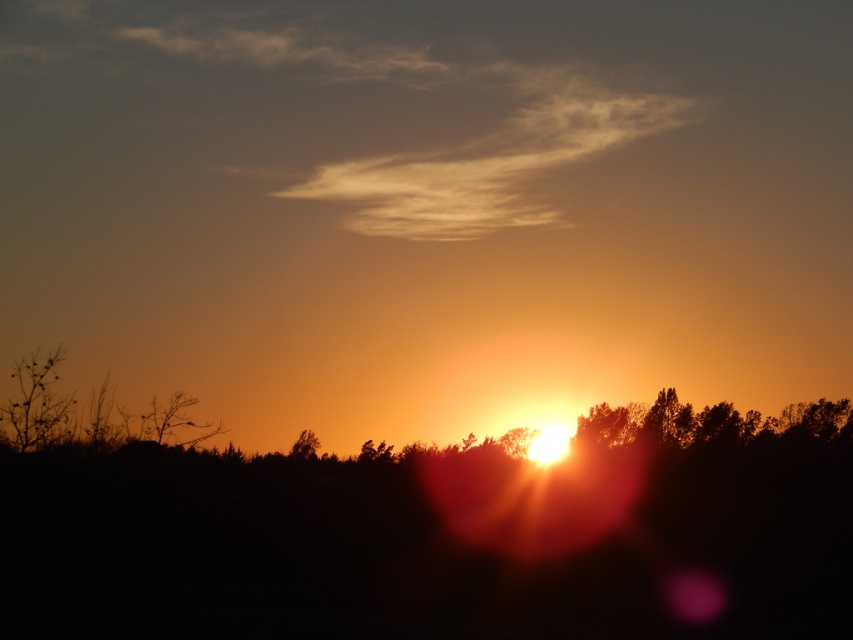
Does bare branches at left have a smaller size compared to silky brown tree at center?

No.

Who is positioned more to the right, bare branches at left or silky brown tree at center?

From the viewer's perspective, silky brown tree at center appears more on the right side.

Describe the element at coordinates (36, 403) in the screenshot. Image resolution: width=853 pixels, height=640 pixels. I see `bare branches at left` at that location.

Where is `bare branches at left`? This screenshot has width=853, height=640. bare branches at left is located at coordinates (36, 403).